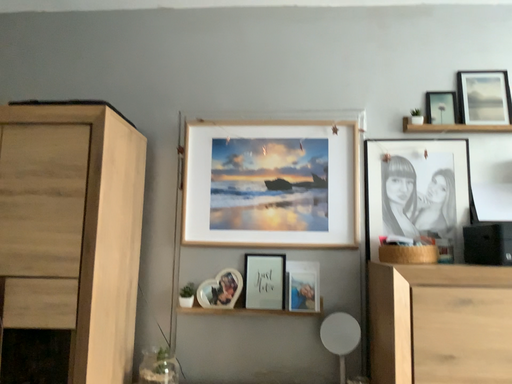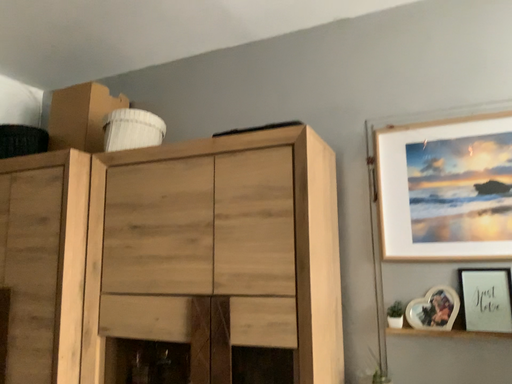
Question: Which way did the camera rotate in the video?

Choices:
 (A) rotated right
 (B) rotated left

Answer: (B)